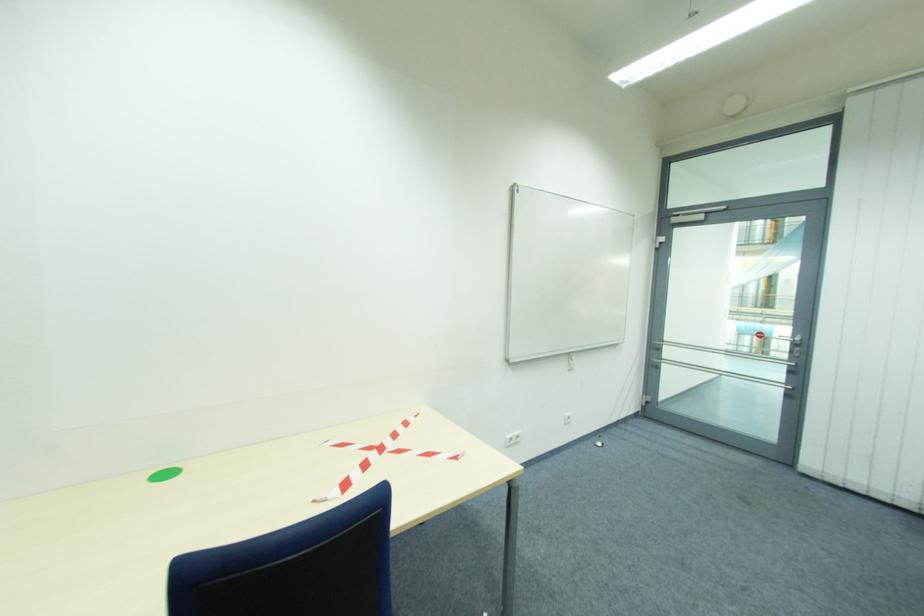
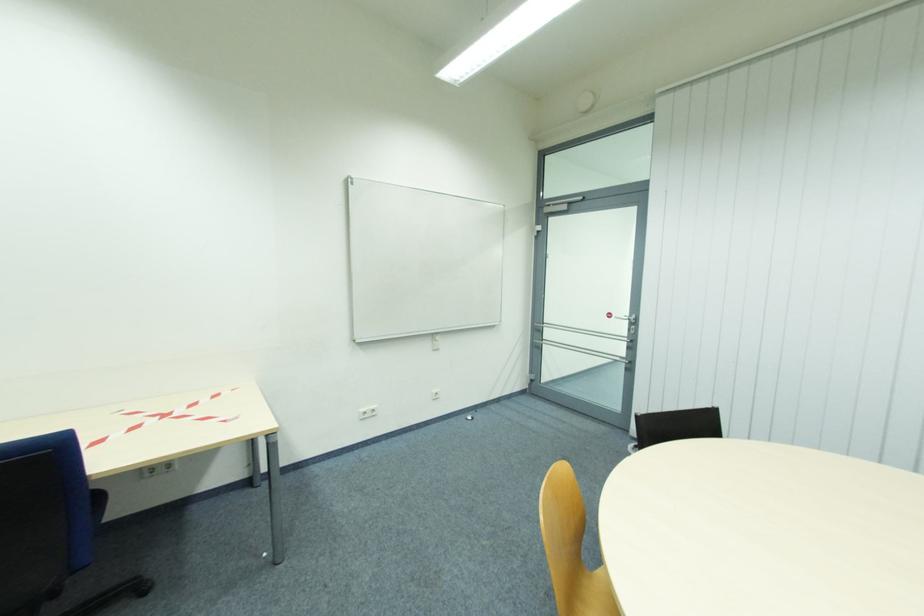
Question: In a continuous first-person perspective shot, in which direction is the camera moving?

Choices:
 (A) Left
 (B) Right
 (C) Forward
 (D) Backward

Answer: (B)